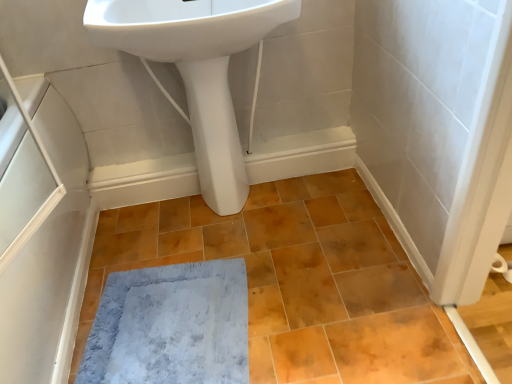
Question: Does white matte screen door at left appear on the right side of white glossy pedestal at center?

Choices:
 (A) yes
 (B) no

Answer: (B)

Question: Does white matte screen door at left have a greater height compared to white glossy pedestal at center?

Choices:
 (A) yes
 (B) no

Answer: (B)

Question: Is white matte screen door at left surrounding white glossy pedestal at center?

Choices:
 (A) yes
 (B) no

Answer: (B)

Question: From the image's perspective, is white matte screen door at left over white glossy pedestal at center?

Choices:
 (A) no
 (B) yes

Answer: (A)

Question: From a real-world perspective, is white matte screen door at left on white glossy pedestal at center?

Choices:
 (A) yes
 (B) no

Answer: (A)

Question: Is white matte screen door at left closer to camera compared to white glossy pedestal at center?

Choices:
 (A) yes
 (B) no

Answer: (A)

Question: From a real-world perspective, is white glossy sink at upper center physically below gray plush bath mat at lower center?

Choices:
 (A) no
 (B) yes

Answer: (A)

Question: Is white glossy sink at upper center wider than gray plush bath mat at lower center?

Choices:
 (A) no
 (B) yes

Answer: (A)

Question: From the image's perspective, is white glossy sink at upper center over gray plush bath mat at lower center?

Choices:
 (A) yes
 (B) no

Answer: (A)

Question: From a real-world perspective, is white glossy sink at upper center on top of gray plush bath mat at lower center?

Choices:
 (A) no
 (B) yes

Answer: (B)

Question: Is gray plush bath mat at lower center located within white glossy sink at upper center?

Choices:
 (A) no
 (B) yes

Answer: (A)

Question: Is there a large distance between white glossy sink at upper center and gray plush bath mat at lower center?

Choices:
 (A) no
 (B) yes

Answer: (A)

Question: Does matte orange ceramic tile at center appear on the left side of white glossy pedestal at center?

Choices:
 (A) yes
 (B) no

Answer: (B)